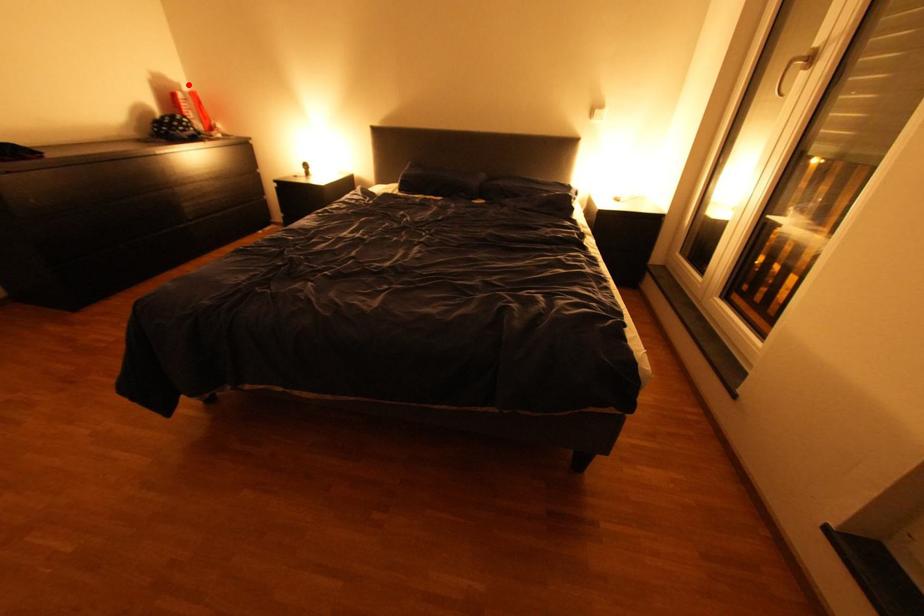
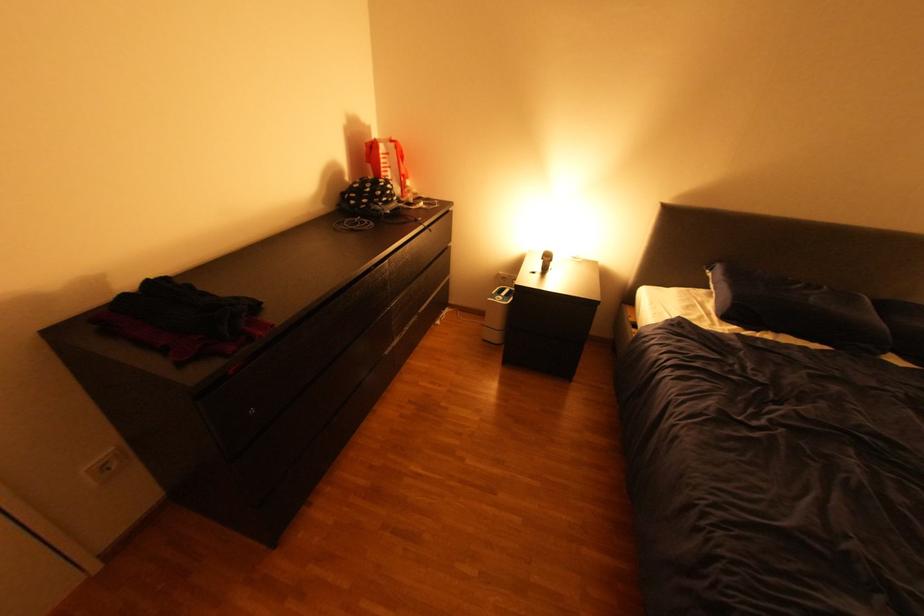
Question: I am providing you with two images of the same scene from different viewpoints. In image1, a red point is highlighted. Considering the same 3D point in image2, which of the following is correct?

Choices:
 (A) It is closer
 (B) It is farther

Answer: (A)